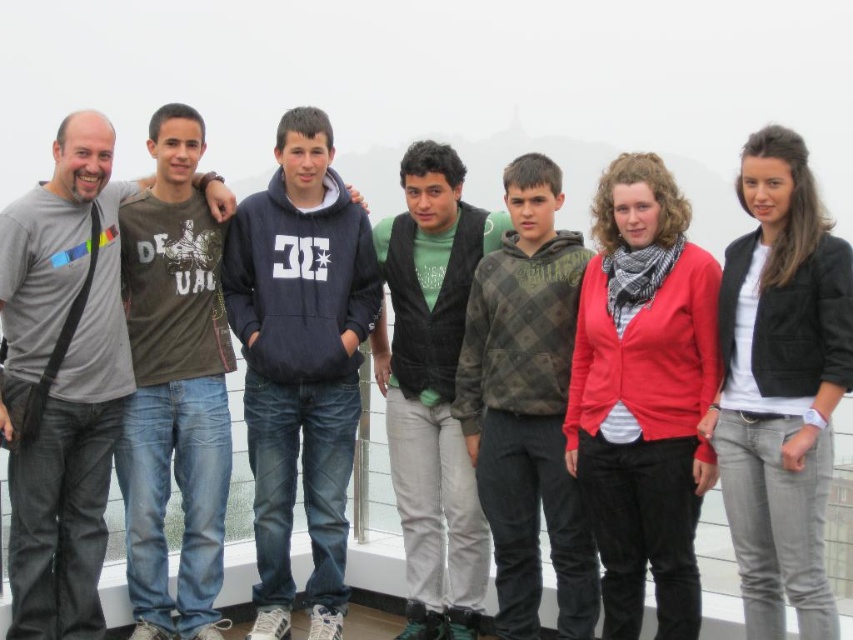
Question: Can you confirm if dark green t-shirt at center is positioned to the right of dark green sweater at center?

Choices:
 (A) no
 (B) yes

Answer: (A)

Question: From the image, what is the correct spatial relationship of dark green t-shirt at center in relation to dark green sweater at center?

Choices:
 (A) below
 (B) above

Answer: (A)

Question: Estimate the real-world distances between objects in this image. Which object is farther from the dark green t-shirt at center?

Choices:
 (A) dark green sweater at center
 (B) gray t-shirt at left

Answer: (A)

Question: Among these points, which one is nearest to the camera?

Choices:
 (A) coord(196,444)
 (B) coord(91,237)
 (C) coord(383,358)

Answer: (B)

Question: Can you confirm if gray t-shirt at left is positioned below dark green sweater at center?

Choices:
 (A) no
 (B) yes

Answer: (B)

Question: Which point appears closest to the camera in this image?

Choices:
 (A) (427, 408)
 (B) (105, 426)
 (C) (183, 250)

Answer: (B)